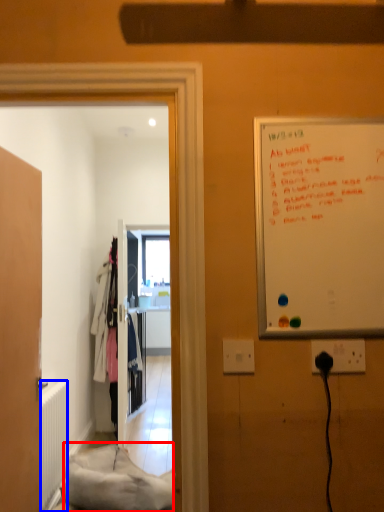
Question: Which object appears farthest to the camera in this image, material (highlighted by a red box) or radiator (highlighted by a blue box)?

Choices:
 (A) material
 (B) radiator

Answer: (B)